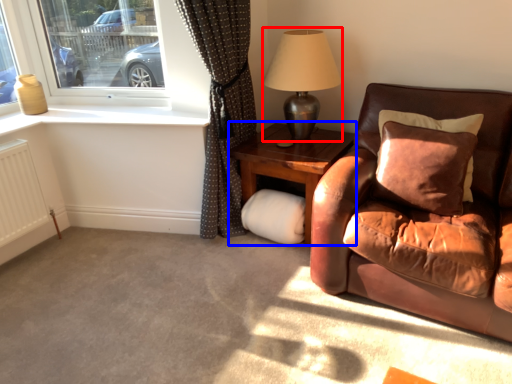
Question: Which object is further to the camera taking this photo, table lamp (highlighted by a red box) or table (highlighted by a blue box)?

Choices:
 (A) table lamp
 (B) table

Answer: (B)